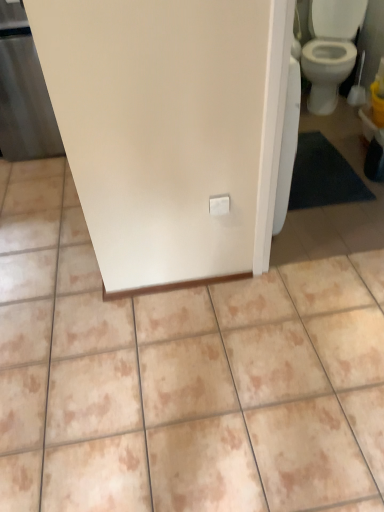
Question: From a real-world perspective, is beige ceramic tile at center above or below matte white screen door at left?

Choices:
 (A) above
 (B) below

Answer: (B)

Question: In terms of height, does beige ceramic tile at center look taller or shorter compared to matte white screen door at left?

Choices:
 (A) tall
 (B) short

Answer: (B)

Question: Considering the positions of beige ceramic tile at center and matte white screen door at left in the image, is beige ceramic tile at center wider or thinner than matte white screen door at left?

Choices:
 (A) thin
 (B) wide

Answer: (B)

Question: Looking at their shapes, would you say matte white screen door at left is wider or thinner than beige ceramic tile at center?

Choices:
 (A) wide
 (B) thin

Answer: (B)

Question: Is matte white screen door at left inside or outside of beige ceramic tile at center?

Choices:
 (A) inside
 (B) outside

Answer: (B)

Question: Would you say matte white screen door at left is to the left or to the right of beige ceramic tile at center in the picture?

Choices:
 (A) left
 (B) right

Answer: (A)

Question: Considering the positions of point (26, 84) and point (269, 400), is point (26, 84) closer or farther from the camera than point (269, 400)?

Choices:
 (A) closer
 (B) farther

Answer: (B)